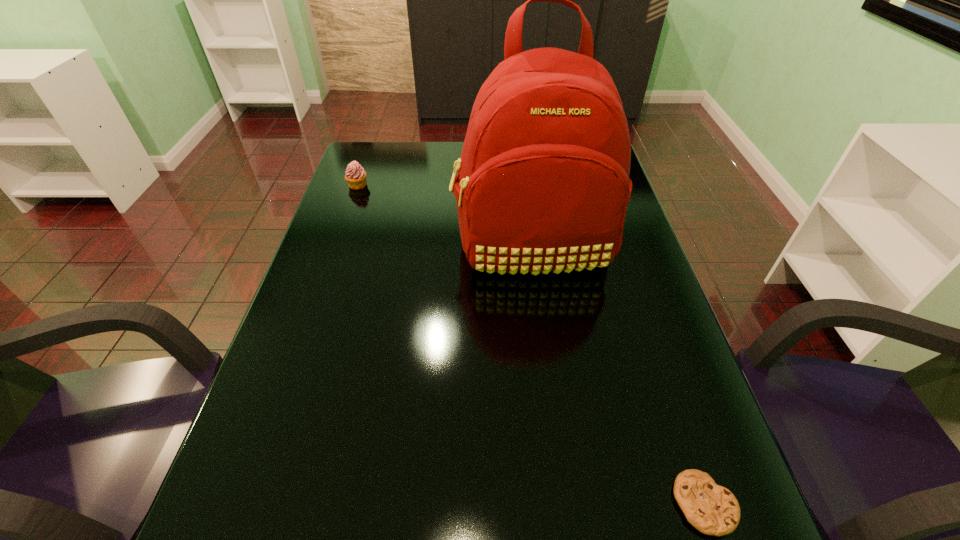
Locate an element on the screen. The width and height of the screenshot is (960, 540). the second nearest object is located at coordinates (543, 185).

I want to click on backpack, so click(x=543, y=185).

Locate an element on the screen. The width and height of the screenshot is (960, 540). the farthest object is located at coordinates (355, 175).

Locate an element on the screen. This screenshot has width=960, height=540. the second shortest object is located at coordinates (355, 175).

The image size is (960, 540). I want to click on the shortest object, so click(x=712, y=509).

Where is `cookie`? This screenshot has width=960, height=540. cookie is located at coordinates (712, 509).

Image resolution: width=960 pixels, height=540 pixels. I want to click on vacant area situated on the front-facing side of the second nearest object, so click(547, 363).

Identify the location of free space located 0.220m on the front of the farthest object. The width and height of the screenshot is (960, 540). (340, 235).

At what (x,y) coordinates should I click in order to perform the action: click on vacant space located 0.340m on the back of the cookie. Please return your answer as a coordinate pair (x, y). The height and width of the screenshot is (540, 960). Looking at the image, I should click on (643, 322).

The width and height of the screenshot is (960, 540). Identify the location of object at the near edge. (712, 509).